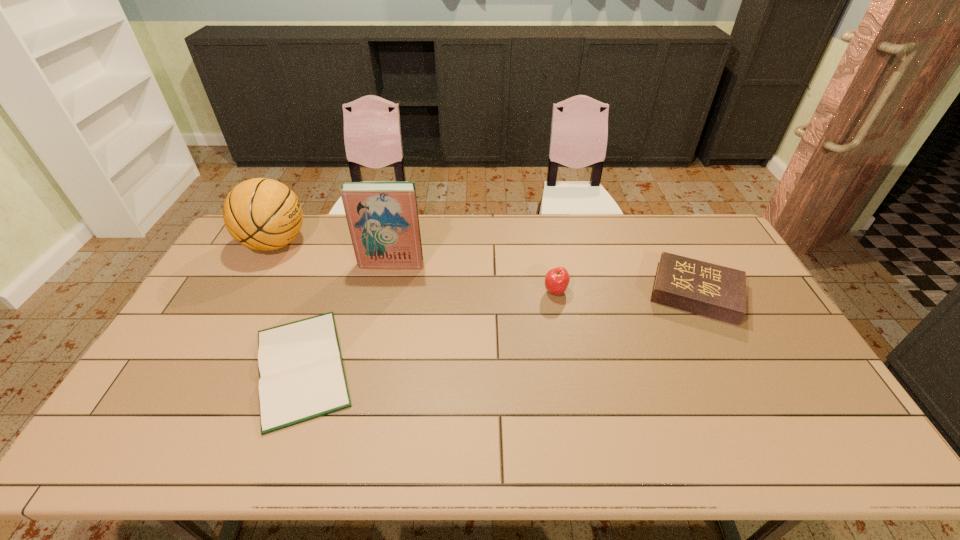
The image size is (960, 540). In order to click on the tallest hardback book in this screenshot , I will do `click(382, 217)`.

Where is `basketball`? basketball is located at coordinates (263, 214).

Identify the location of apple. (556, 280).

This screenshot has height=540, width=960. Find the location of `the second object from right to left`. the second object from right to left is located at coordinates (556, 280).

The width and height of the screenshot is (960, 540). In order to click on the rightmost hardback book in this screenshot , I will do `click(714, 291)`.

What are the coordinates of `the second tallest hardback book` in the screenshot? It's located at point(714,291).

Where is `the shortest object`? This screenshot has width=960, height=540. the shortest object is located at coordinates (301, 374).

Where is `free space located 0.270m on the cover of the tallest hardback book`? This screenshot has height=540, width=960. free space located 0.270m on the cover of the tallest hardback book is located at coordinates (376, 331).

Find the location of a particular element. free space located 0.360m on the surface of the basketball near the brand logo is located at coordinates (409, 243).

Where is `blank space located on the front of the apple`? This screenshot has width=960, height=540. blank space located on the front of the apple is located at coordinates (570, 372).